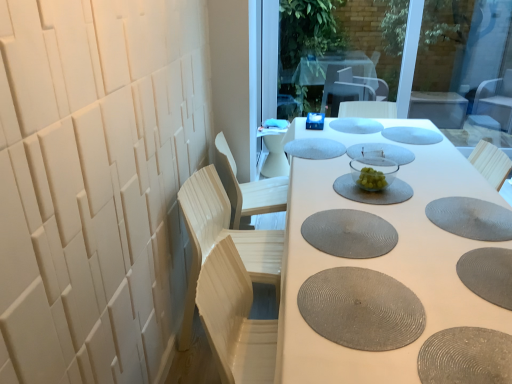
I want to click on vacant area that lies between gray rubber mat at center, which appears as the 2th manhole cover when viewed from the back, and clear glass bowl at center, placed as the seventh manhole cover when sorted from front to back, so click(x=389, y=143).